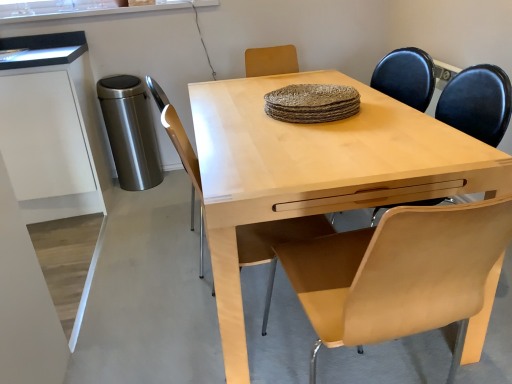
Question: From the image's perspective, is light wood desk at center positioned above or below light brown leather chair at center?

Choices:
 (A) above
 (B) below

Answer: (A)

Question: Is point (242, 379) positioned closer to the camera than point (266, 231)?

Choices:
 (A) farther
 (B) closer

Answer: (B)

Question: Which object is positioned farthest from the light wood desk at center?

Choices:
 (A) white matte cabinet at left
 (B) light brown leather chair at center

Answer: (A)

Question: Which of these objects is positioned closest to the white matte cabinet at left?

Choices:
 (A) light brown leather chair at center
 (B) light wood desk at center

Answer: (B)